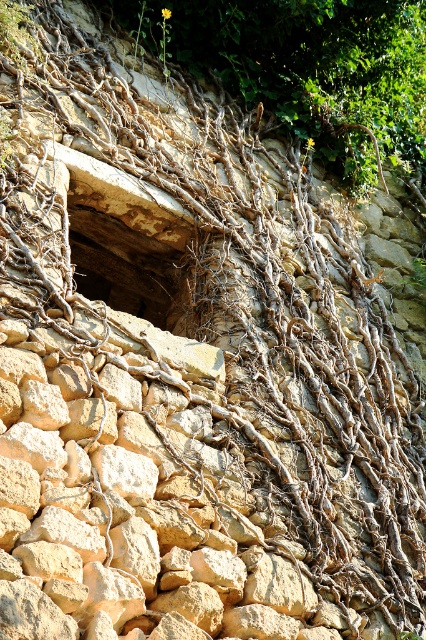
You are an archaeologist examining the stone wall. You notice the brown rough roots at center and the brown rough stone hole at center. Which object is closer to your viewpoint?

The brown rough roots at center are closer to your viewpoint as they are positioned in front of the brown rough stone hole at center.

You are an archaeologist examining the stone wall. You notice the brown rough roots at center and the brown rough stone hole at center. Which one is closer to the ground?

The brown rough roots at center are closer to the ground than the brown rough stone hole at center because the roots are shorter than the hole.

You are standing in front of the stone wall and notice two points marked on it. Which point is closer to you, point (146, 8) or point (115, 244)?

Point (146, 8) is further to the viewer than point (115, 244), so point (115, 244) is closer to you.